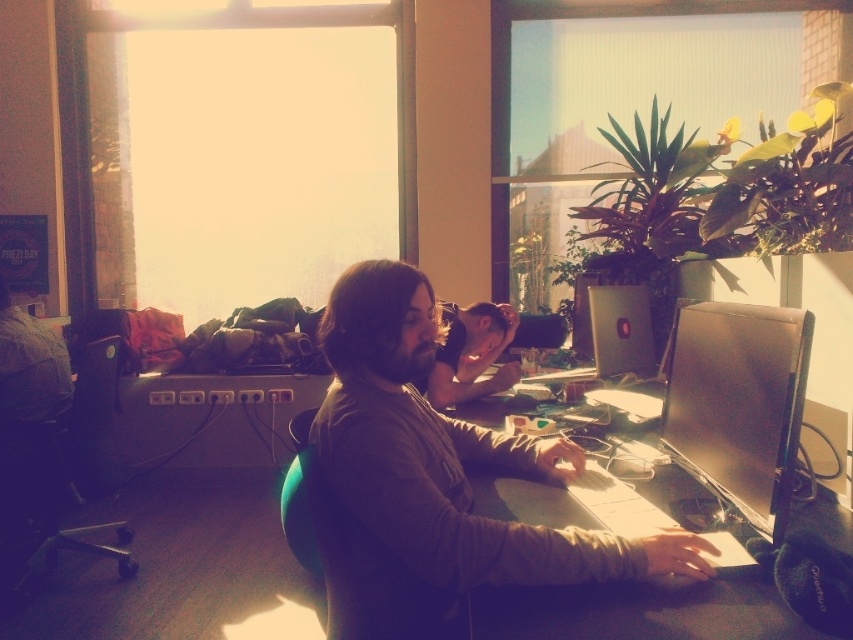
Question: Is matte brown shirt at center positioned in front of black glossy monitor at center?

Choices:
 (A) no
 (B) yes

Answer: (A)

Question: Among these objects, which one is farthest from the camera?

Choices:
 (A) matte brown shirt at center
 (B) silver metallic laptop at center
 (C) matte black laptop at center

Answer: (B)

Question: Does smooth wooden table at center have a smaller size compared to silver metallic laptop at center?

Choices:
 (A) no
 (B) yes

Answer: (B)

Question: In this image, where is silver metallic laptop at center located relative to matte black laptop at center?

Choices:
 (A) left
 (B) right

Answer: (B)

Question: Considering the real-world distances, which object is closest to the smooth wooden table at center?

Choices:
 (A) matte black laptop at center
 (B) silver metallic laptop at center

Answer: (A)

Question: Among these points, which one is farthest from the camera?

Choices:
 (A) (624, 604)
 (B) (498, 449)
 (C) (456, 314)

Answer: (C)